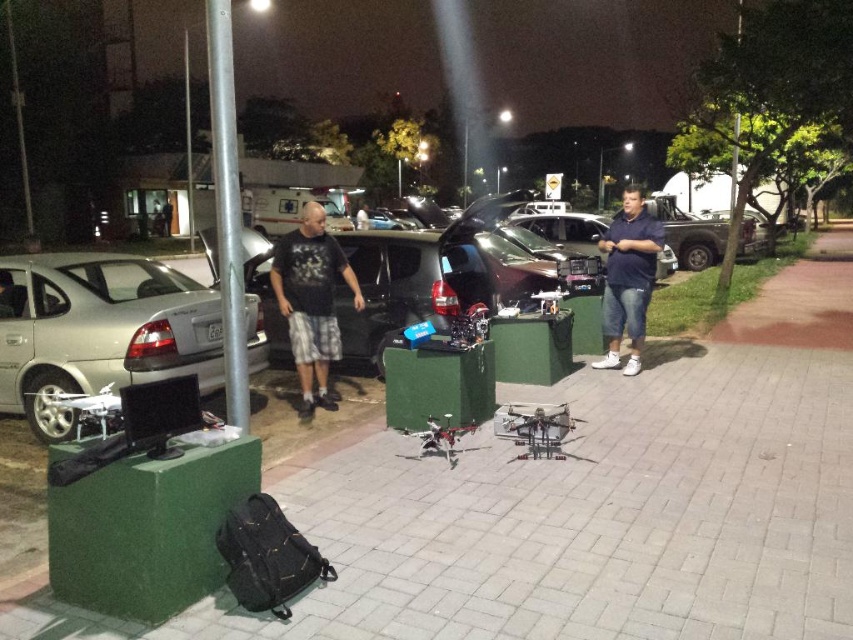
Question: Is black cotton t-shirt at center wider than blue cotton shirt at center?

Choices:
 (A) no
 (B) yes

Answer: (A)

Question: Is silver metallic pole at center-left to the left of black cotton t-shirt at center from the viewer's perspective?

Choices:
 (A) no
 (B) yes

Answer: (B)

Question: Which is farther from the black cotton t-shirt at center?

Choices:
 (A) blue cotton shirt at center
 (B) silver metallic car at left
 (C) silver metallic pole at center-left

Answer: (A)

Question: Does black cotton t-shirt at center appear on the right side of blue cotton shirt at center?

Choices:
 (A) yes
 (B) no

Answer: (B)

Question: Which point is farther to the camera?

Choices:
 (A) (619, 332)
 (B) (41, 260)

Answer: (A)

Question: Which object appears farthest from the camera in this image?

Choices:
 (A) black cotton t-shirt at center
 (B) silver metallic pole at center-left

Answer: (A)